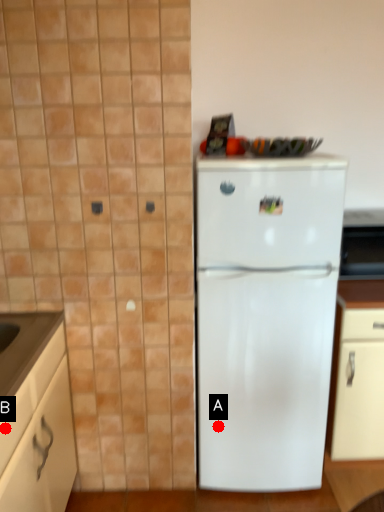
Question: Two points are circled on the image, labeled by A and B beside each circle. Which point is further to the camera?

Choices:
 (A) A is further
 (B) B is further

Answer: (A)